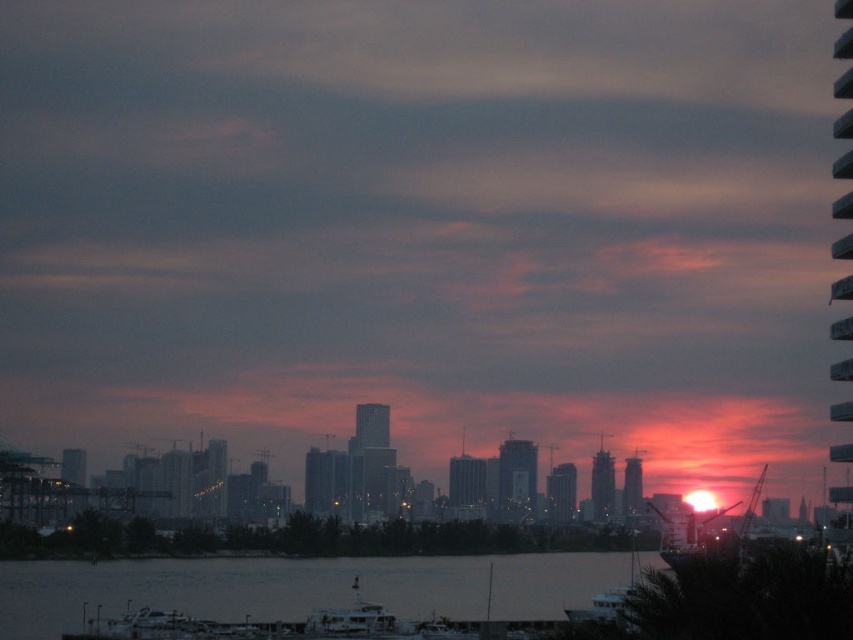
Question: Which point is farther to the camera?

Choices:
 (A) metallic silver boat at lower center
 (B) silvery water at lower center

Answer: (B)

Question: Is silvery water at lower center wider than metallic silver boat at lower center?

Choices:
 (A) no
 (B) yes

Answer: (B)

Question: From the image, what is the correct spatial relationship of silvery water at lower center in relation to metallic silver boat at lower center?

Choices:
 (A) left
 (B) right

Answer: (A)

Question: Which of the following is the farthest from the observer?

Choices:
 (A) metallic silver boat at lower center
 (B) silvery water at lower center

Answer: (B)

Question: Does silvery water at lower center have a greater width compared to metallic silver boat at lower center?

Choices:
 (A) yes
 (B) no

Answer: (A)